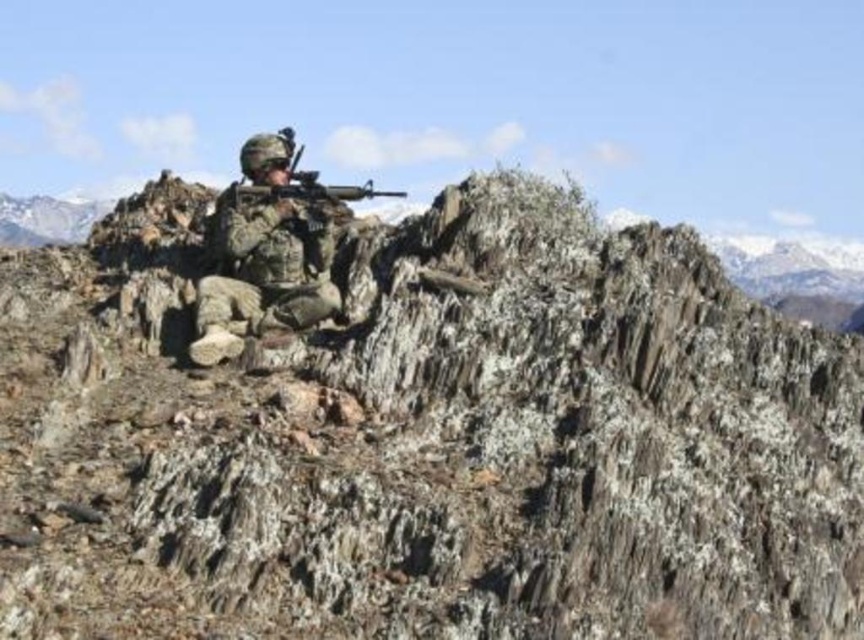
Question: Which is nearer to the snowy granite mountain at upper left?

Choices:
 (A) camouflage fabric uniform at center
 (B) rocky cliff at center

Answer: (B)

Question: Considering the relative positions of rocky cliff at center and matte black rifle at center in the image provided, where is rocky cliff at center located with respect to matte black rifle at center?

Choices:
 (A) left
 (B) right

Answer: (B)

Question: Among these points, which one is farthest from the camera?

Choices:
 (A) (233, 189)
 (B) (570, 195)
 (C) (37, 227)
 (D) (206, 340)

Answer: (C)

Question: Does camouflage fabric uniform at center come in front of snowy granite mountain at upper left?

Choices:
 (A) yes
 (B) no

Answer: (A)

Question: Can you confirm if rocky cliff at center is positioned above camouflage fabric uniform at center?

Choices:
 (A) no
 (B) yes

Answer: (A)

Question: Which point appears farthest from the camera in this image?

Choices:
 (A) (284, 160)
 (B) (52, 211)
 (C) (239, 193)
 (D) (605, 433)

Answer: (B)